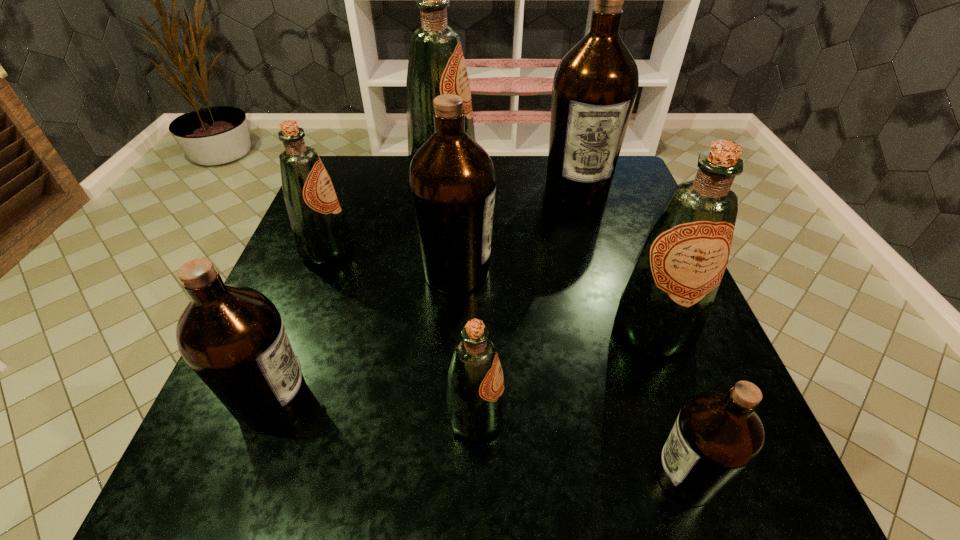
What are the coordinates of `free region located on the label of the nearest brown olive oil` in the screenshot? It's located at (590, 476).

What are the coordinates of `vacant space situated 0.100m on the label of the nearest brown olive oil` in the screenshot? It's located at (584, 476).

Identify the location of object situated at the near edge. (717, 436).

Locate an element on the screen. The image size is (960, 540). object that is at the far right corner is located at coordinates (595, 85).

Identify the location of object at the near right corner. The height and width of the screenshot is (540, 960). (717, 436).

Where is `free space at the far edge of the desktop`? This screenshot has width=960, height=540. free space at the far edge of the desktop is located at coordinates (393, 176).

This screenshot has width=960, height=540. Identify the location of vacant region at the near edge of the desktop. (424, 503).

Identify the location of vacant space at the left edge of the desktop. (330, 314).

In the image, there is a desktop. Find the location of `vacant region at the right edge`. vacant region at the right edge is located at coordinates (635, 246).

I want to click on free location at the far left corner, so [x=365, y=178].